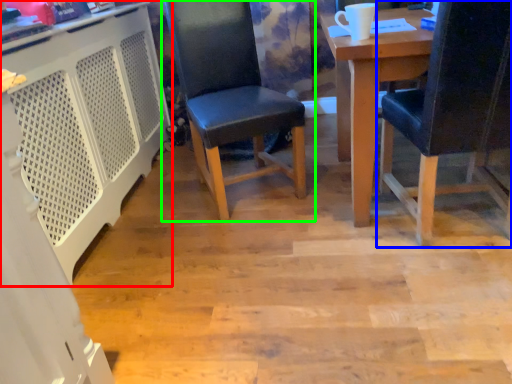
Question: Which object is the farthest from computer desk (highlighted by a red box)? Choose among these: chair (highlighted by a blue box) or chair (highlighted by a green box).

Choices:
 (A) chair
 (B) chair

Answer: (A)